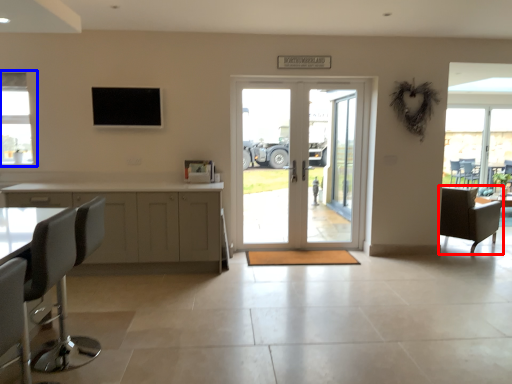
Question: Which point is closer to the camera, chair (highlighted by a red box) or window (highlighted by a blue box)?

Choices:
 (A) chair
 (B) window

Answer: (B)